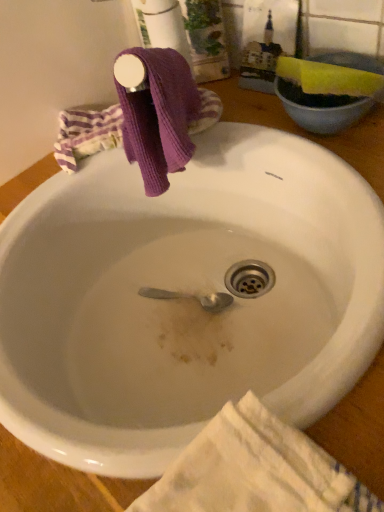
Question: Can you confirm if white glossy sink at upper center is positioned to the left of white textured towel at lower right?

Choices:
 (A) yes
 (B) no

Answer: (A)

Question: Considering the relative sizes of white glossy sink at upper center and white textured towel at lower right in the image provided, is white glossy sink at upper center smaller than white textured towel at lower right?

Choices:
 (A) no
 (B) yes

Answer: (A)

Question: Is the position of white glossy sink at upper center more distant than that of white textured towel at lower right?

Choices:
 (A) yes
 (B) no

Answer: (A)

Question: Could you tell me if white glossy sink at upper center is turned towards white textured towel at lower right?

Choices:
 (A) yes
 (B) no

Answer: (B)

Question: Is white glossy sink at upper center touching white textured towel at lower right?

Choices:
 (A) no
 (B) yes

Answer: (A)

Question: Is white glossy sink at upper center positioned far away from white textured towel at lower right?

Choices:
 (A) yes
 (B) no

Answer: (B)

Question: Would you say white textured towel at lower right contains white glossy sink at upper center?

Choices:
 (A) no
 (B) yes

Answer: (A)

Question: Does white textured towel at lower right appear on the right side of white glossy sink at upper center?

Choices:
 (A) yes
 (B) no

Answer: (A)

Question: Are white textured towel at lower right and white glossy sink at upper center making contact?

Choices:
 (A) yes
 (B) no

Answer: (B)

Question: Considering the relative sizes of white textured towel at lower right and white glossy sink at upper center in the image provided, is white textured towel at lower right thinner than white glossy sink at upper center?

Choices:
 (A) yes
 (B) no

Answer: (A)

Question: From the image's perspective, does white textured towel at lower right appear higher than white glossy sink at upper center?

Choices:
 (A) no
 (B) yes

Answer: (A)

Question: From a real-world perspective, does white textured towel at lower right sit lower than white glossy sink at upper center?

Choices:
 (A) yes
 (B) no

Answer: (B)

Question: From a real-world perspective, is white glossy sink at upper center positioned above or below white textured towel at lower right?

Choices:
 (A) below
 (B) above

Answer: (A)